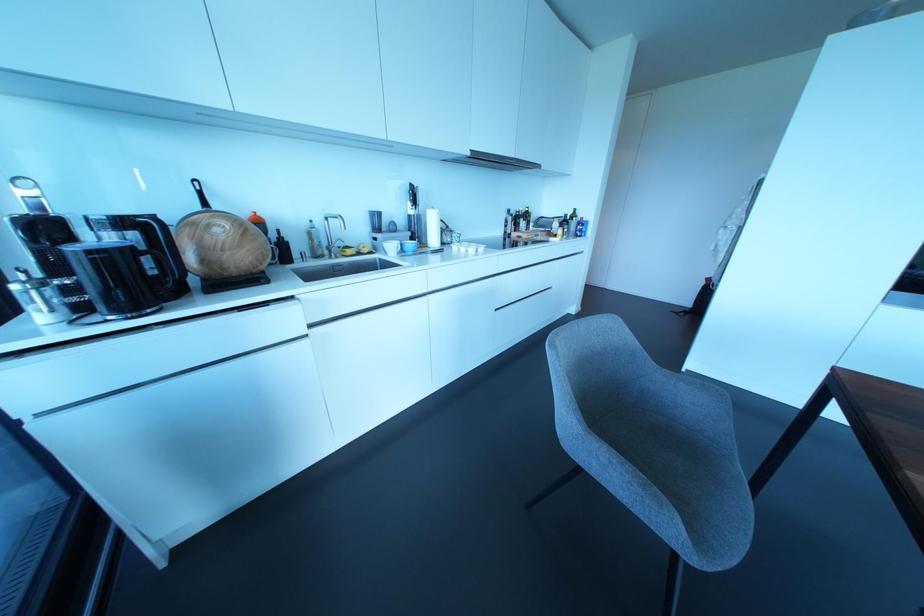
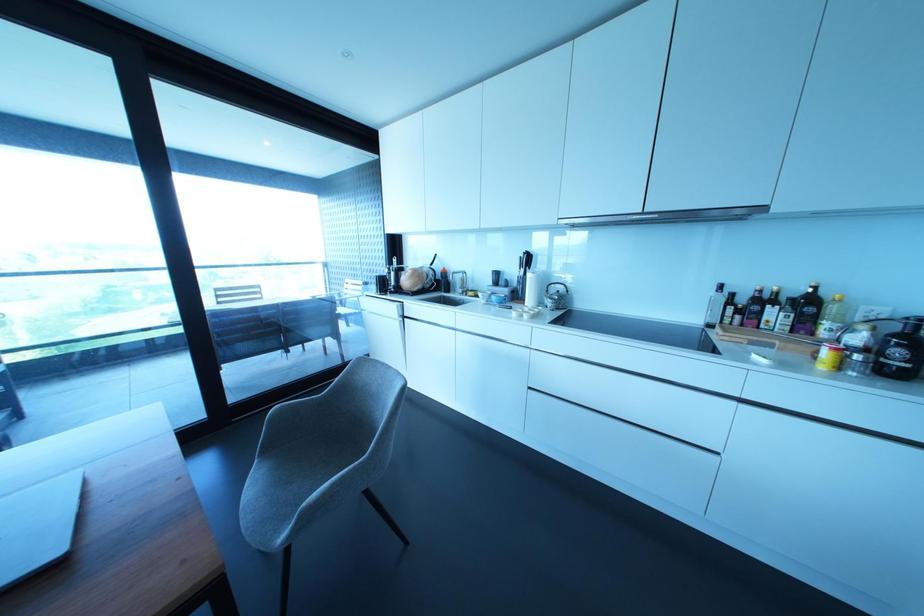
In the second image, find the point that corresponds to [526,216] in the first image.

(807, 304)